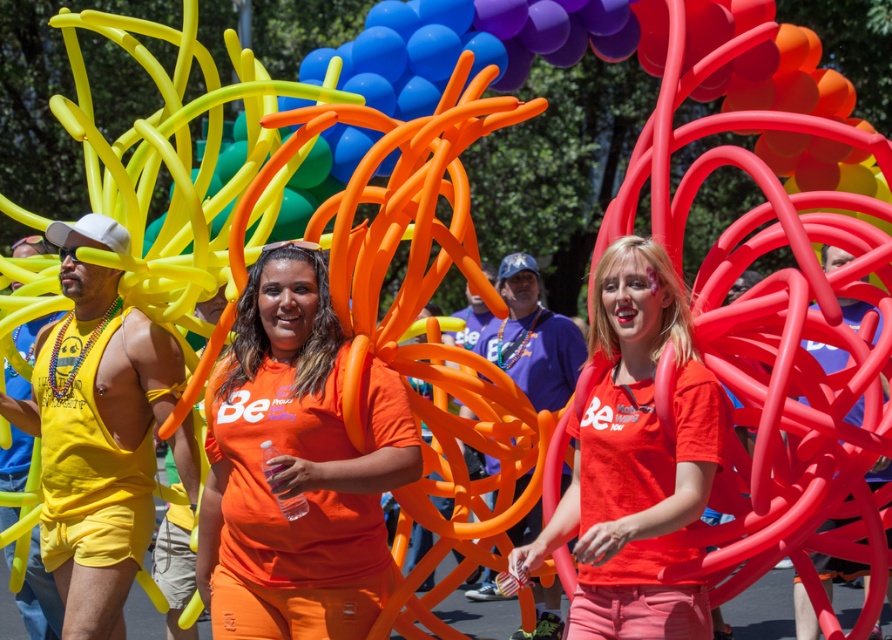
Question: Considering the relative positions of orange matte shirt at center and rubber balloon at center in the image provided, where is orange matte shirt at center located with respect to rubber balloon at center?

Choices:
 (A) below
 (B) above

Answer: (A)

Question: Which point appears farthest from the camera in this image?

Choices:
 (A) (563, 532)
 (B) (306, 628)

Answer: (B)

Question: Is matte yellow tank top at left to the left of rubber balloon at center from the viewer's perspective?

Choices:
 (A) no
 (B) yes

Answer: (B)

Question: Which point appears farthest from the camera in this image?

Choices:
 (A) (274, 506)
 (B) (89, 448)

Answer: (B)

Question: Which point is farther to the camera?

Choices:
 (A) matte orange shirt at center
 (B) orange matte shirt at center
 (C) matte yellow tank top at left
 (D) rubber balloon at center

Answer: (D)

Question: Where is orange matte shirt at center located in relation to matte yellow tank top at left in the image?

Choices:
 (A) left
 (B) right

Answer: (B)